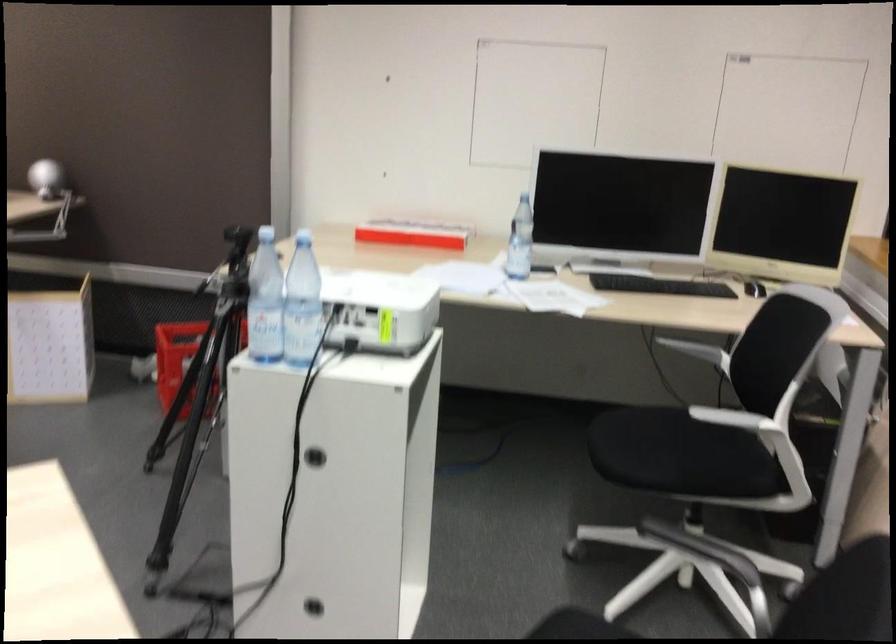
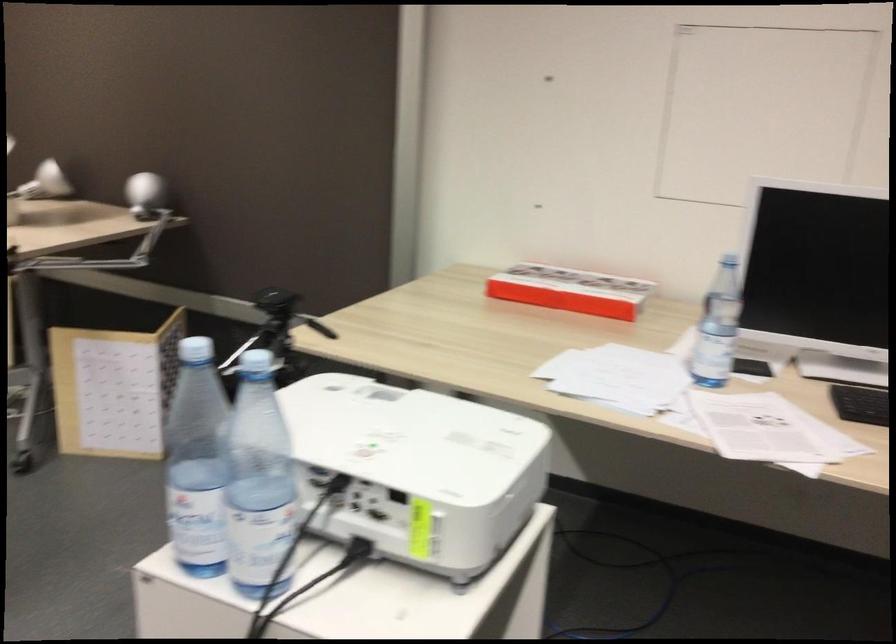
Question: The first image is from the beginning of the video and the second image is from the end. How did the camera likely rotate when shooting the video?

Choices:
 (A) Left
 (B) Right
 (C) Up
 (D) Down

Answer: (A)